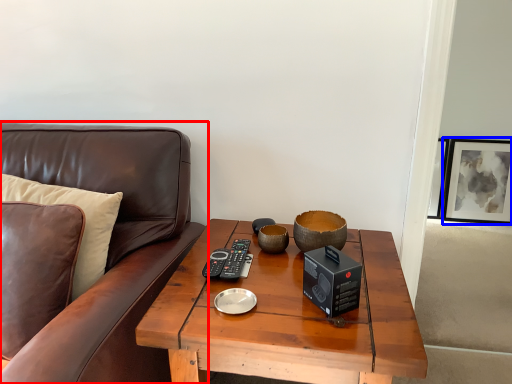
Question: Among these objects, which one is farthest to the camera, studio couch (highlighted by a red box) or picture frame (highlighted by a blue box)?

Choices:
 (A) studio couch
 (B) picture frame

Answer: (B)